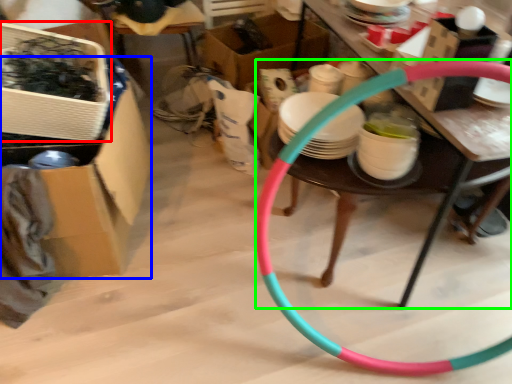
Question: Considering the real-world distances, which object is farthest from box (highlighted by a red box)? box (highlighted by a blue box) or table (highlighted by a green box)?

Choices:
 (A) box
 (B) table

Answer: (B)